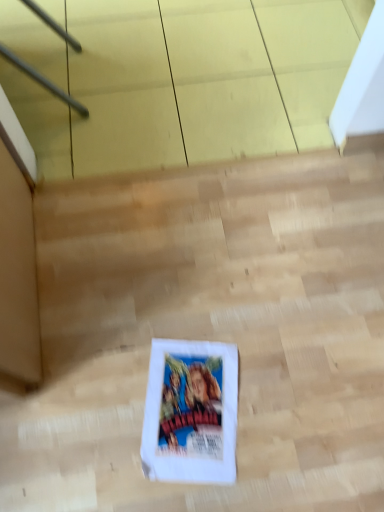
Where is `blank space situated above white paper comic book at center (from a real-world perspective)`? Image resolution: width=384 pixels, height=512 pixels. blank space situated above white paper comic book at center (from a real-world perspective) is located at coordinates click(196, 403).